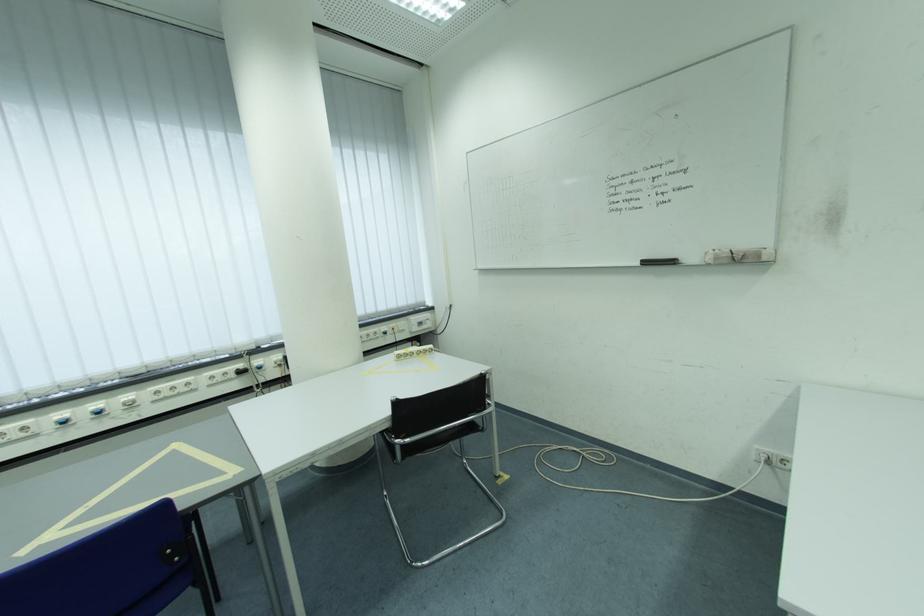
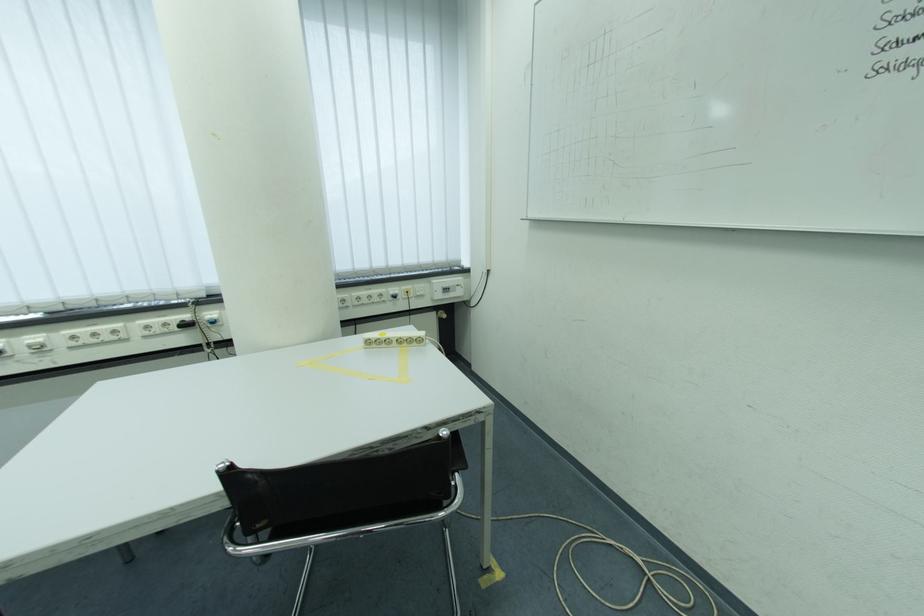
Locate, in the second image, the point that corresponds to (x=429, y=326) in the first image.

(455, 292)